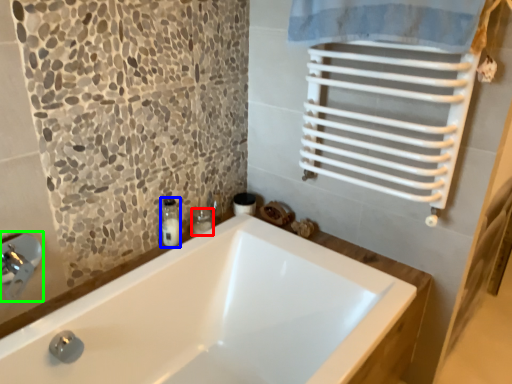
Question: Which object is the farthest from toiletry (highlighted by a red box)? Choose among these: soap dispenser (highlighted by a blue box) or faucet (highlighted by a green box).

Choices:
 (A) soap dispenser
 (B) faucet

Answer: (B)